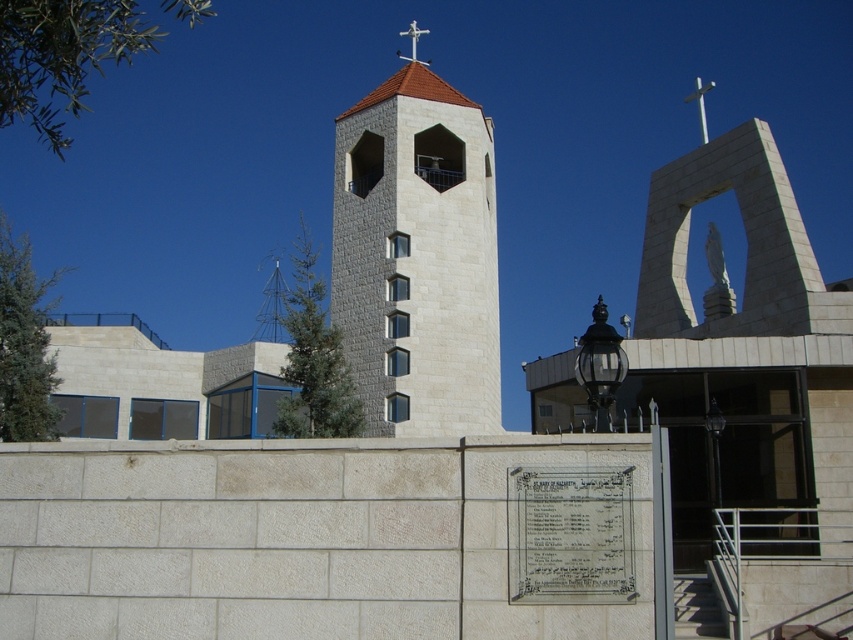
Locate an element on the screen. beige stone bell tower at center is located at coordinates (416, 256).

Which is in front, point (424, 337) or point (512, 496)?

Point (512, 496)

Where is `beige stone bell tower at center`? beige stone bell tower at center is located at coordinates (416, 256).